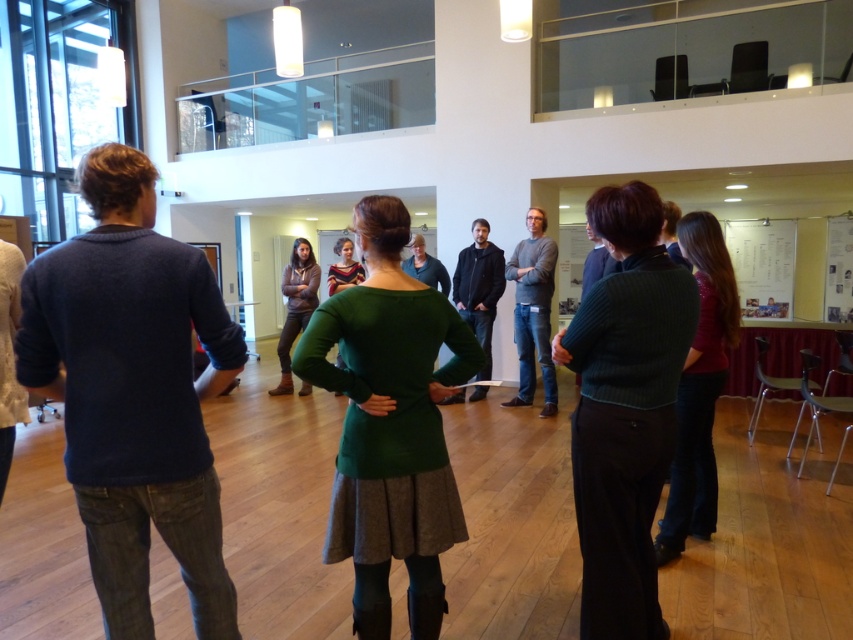
Can you confirm if dark green sweater at center is positioned to the left of dark gray sweater at center?

No, dark green sweater at center is not to the left of dark gray sweater at center.

Can you confirm if dark green sweater at center is smaller than dark gray sweater at center?

Yes.

Is point (630, 432) positioned after point (495, 259)?

No, it is in front of (495, 259).

You are a GUI agent. You are given a task and a screenshot of the screen. Output one action in this format:
    pyautogui.click(x=<x>, y=<y>)
    Task: Click on the dark green sweater at center
    Image resolution: width=853 pixels, height=640 pixels.
    Given the screenshot: What is the action you would take?
    pyautogui.click(x=625, y=410)

Is dark blue sweater at left thinner than dark gray sweater at center?

No.

Where is `dark blue sweater at left`? This screenshot has width=853, height=640. dark blue sweater at left is located at coordinates (132, 392).

Image resolution: width=853 pixels, height=640 pixels. I want to click on dark blue sweater at left, so click(x=132, y=392).

Who is more forward, (410,374) or (697,464)?

Point (410,374)

Does green woolen sweater at center have a greater height compared to shiny red sweater at center?

No.

This screenshot has height=640, width=853. I want to click on green woolen sweater at center, so click(x=390, y=424).